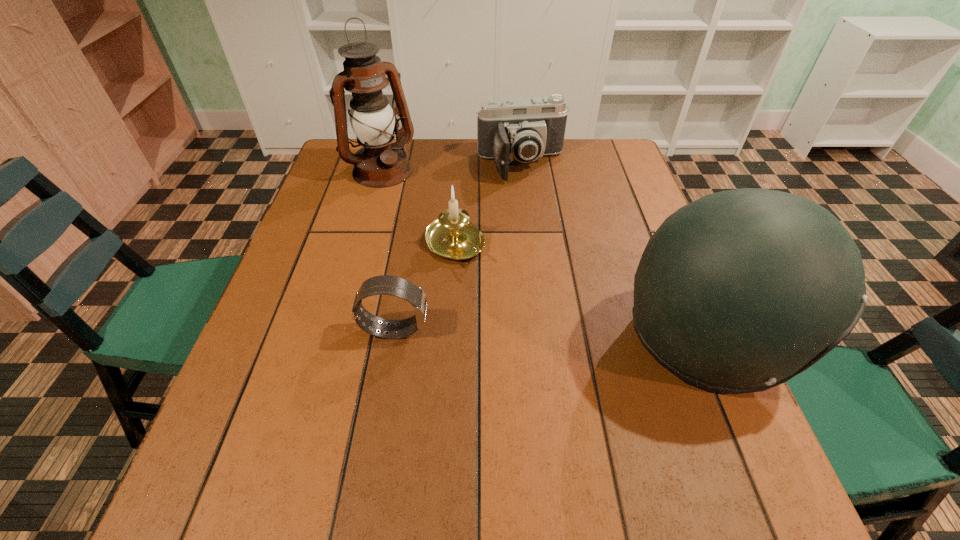
Identify the location of blank region between the tallest object and the watch. (388, 250).

Locate an element on the screen. The height and width of the screenshot is (540, 960). free area in between the football helmet and the camera is located at coordinates (613, 252).

I want to click on blank region between the fourth shortest object and the tallest object, so click(x=543, y=255).

Where is `free space between the candle holder and the camera`? The height and width of the screenshot is (540, 960). free space between the candle holder and the camera is located at coordinates (489, 204).

Find the location of a particular element. This screenshot has width=960, height=540. free space between the candle holder and the tallest object is located at coordinates (418, 207).

Find the location of a particular element. vacant area that lies between the watch and the candle holder is located at coordinates (425, 287).

Where is `vacant region between the shortest object and the third nearest object`? Image resolution: width=960 pixels, height=540 pixels. vacant region between the shortest object and the third nearest object is located at coordinates (425, 287).

This screenshot has width=960, height=540. Identify the location of the second closest object to the rightmost object. (523, 129).

Image resolution: width=960 pixels, height=540 pixels. In order to click on the closest object to the football helmet in this screenshot , I will do `click(453, 237)`.

The width and height of the screenshot is (960, 540). I want to click on free space that satisfies the following two spatial constraints: 1. on the back side of the third farthest object; 2. on the right side of the camera, so [460, 165].